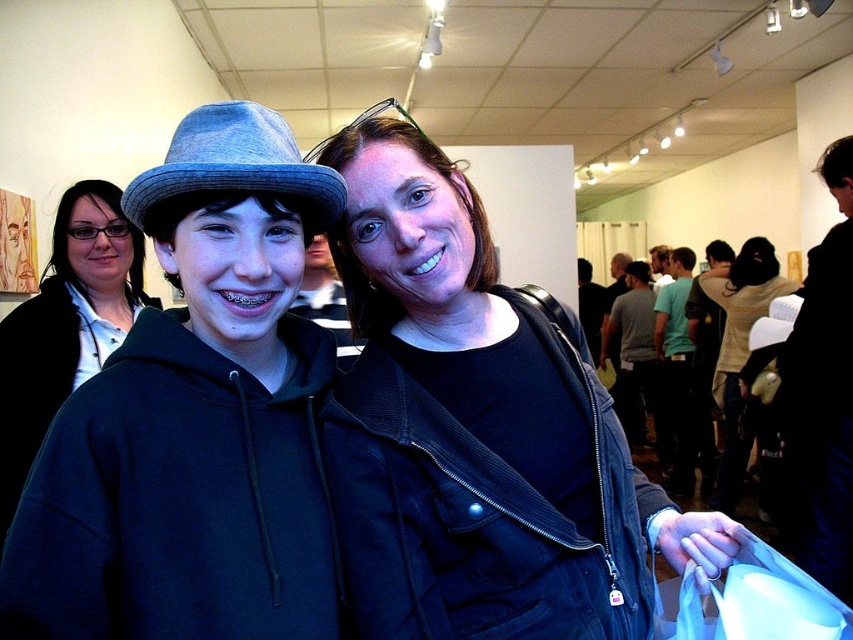
Question: Which of the following is the farthest from the observer?

Choices:
 (A) (126, 328)
 (B) (680, 316)
 (C) (212, 147)

Answer: (B)

Question: Based on their relative distances, which object is farther from the black leather jacket at right?

Choices:
 (A) matte gray hat at center
 (B) denim textured hat at center

Answer: (B)

Question: Is matte black jacket at center to the left of black leather jacket at right from the viewer's perspective?

Choices:
 (A) no
 (B) yes

Answer: (B)

Question: Which of the following is the closest to the observer?

Choices:
 (A) (819, 336)
 (B) (281, 140)
 (C) (732, 512)
 (D) (120, 573)

Answer: (D)

Question: Can you confirm if black corduroy jacket at center is positioned to the left of matte black jacket at center?

Choices:
 (A) yes
 (B) no

Answer: (B)

Question: Is light beige sweater at center closer to the viewer compared to gray cotton t-shirt at center-right?

Choices:
 (A) no
 (B) yes

Answer: (B)